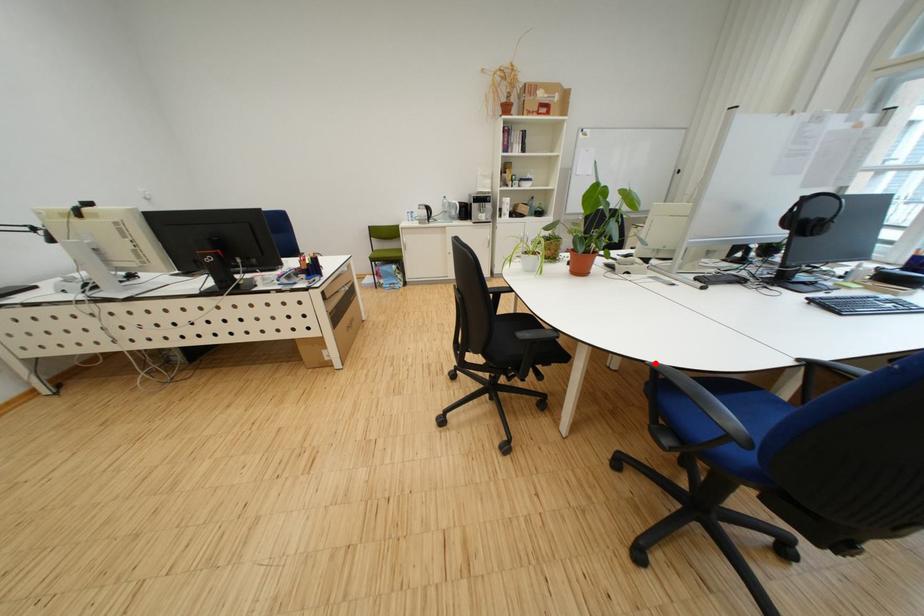
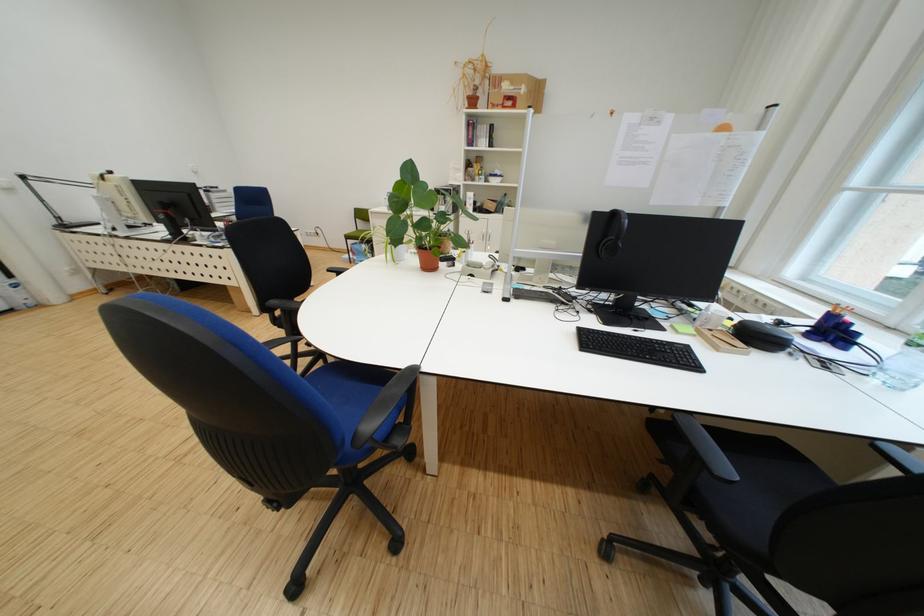
Question: I am providing you with two images of the same scene from different viewpoints. A red point is marked on the first image. Is the red point's position out of view in image 2?

Choices:
 (A) Yes
 (B) No

Answer: (A)